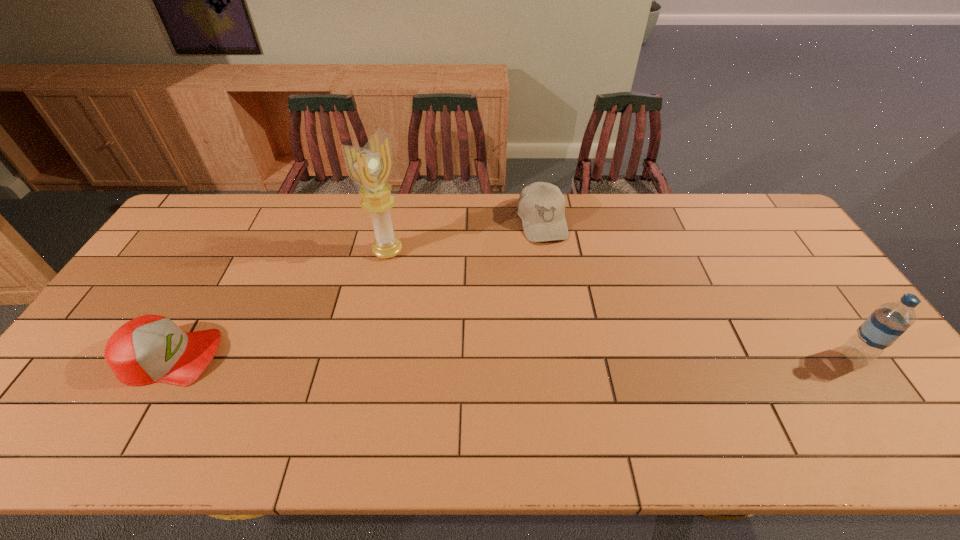
Where is `free space at the far edge`? free space at the far edge is located at coordinates (354, 226).

In the image, there is a desktop. Where is `free space at the near edge`? free space at the near edge is located at coordinates (345, 385).

The height and width of the screenshot is (540, 960). In the image, there is a desktop. What are the coordinates of `vacant space at the left edge` in the screenshot? It's located at (174, 255).

The image size is (960, 540). What are the coordinates of `free spot at the right edge of the desktop` in the screenshot? It's located at (831, 356).

Identify the location of vacant position at the far left corner of the desktop. The width and height of the screenshot is (960, 540). (229, 208).

Identify the location of unoccupied area between the left baseball cap and the water bottle. The width and height of the screenshot is (960, 540). (513, 356).

Locate an element on the screen. free space between the right baseball cap and the third object from right to left is located at coordinates (465, 237).

Identify the location of vacant space in between the rightmost object and the farther baseball cap. (698, 289).

I want to click on free spot between the tallest object and the nearer baseball cap, so click(279, 304).

In order to click on free space between the farther baseball cap and the water bottle in this screenshot , I will do `click(698, 289)`.